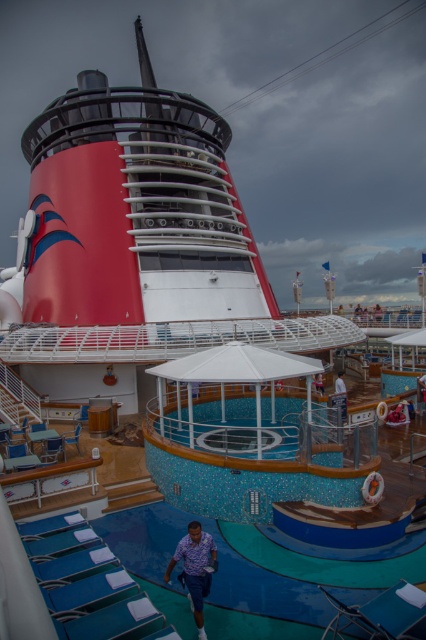
You are standing on the deck of the Disney Cruise ship and want to locate the blue mosaic tiles at center. According to the coordinates provided, where exactly should you look?

The blue mosaic tiles at center are located at point (273, 588).

You are a guest on the Disney Cruise ship and want to enjoy the pool area. You see the blue mosaic tiles at center and the white fabric umbrella at upper center. Which object is located to the left of the other?

The blue mosaic tiles at center is positioned on the left side of white fabric umbrella at upper center.